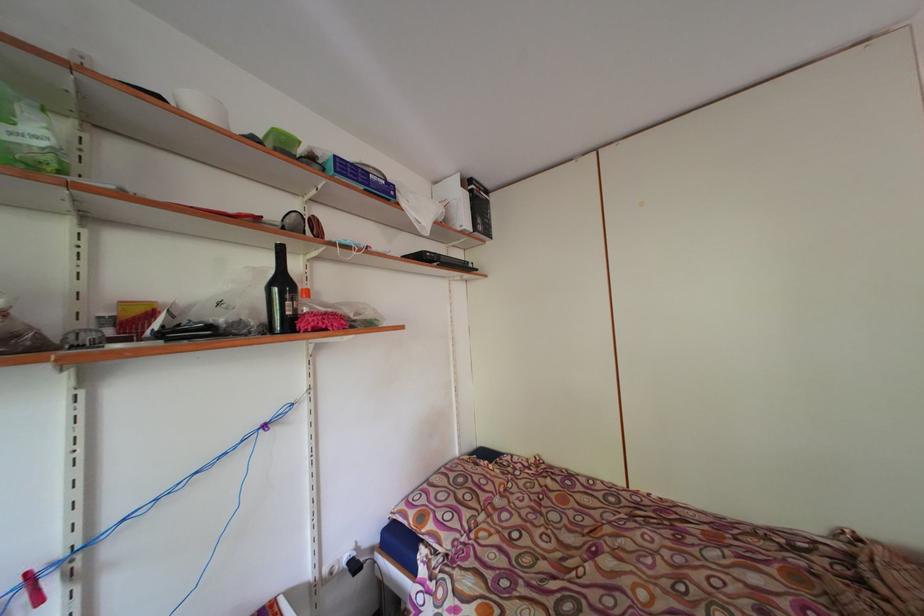
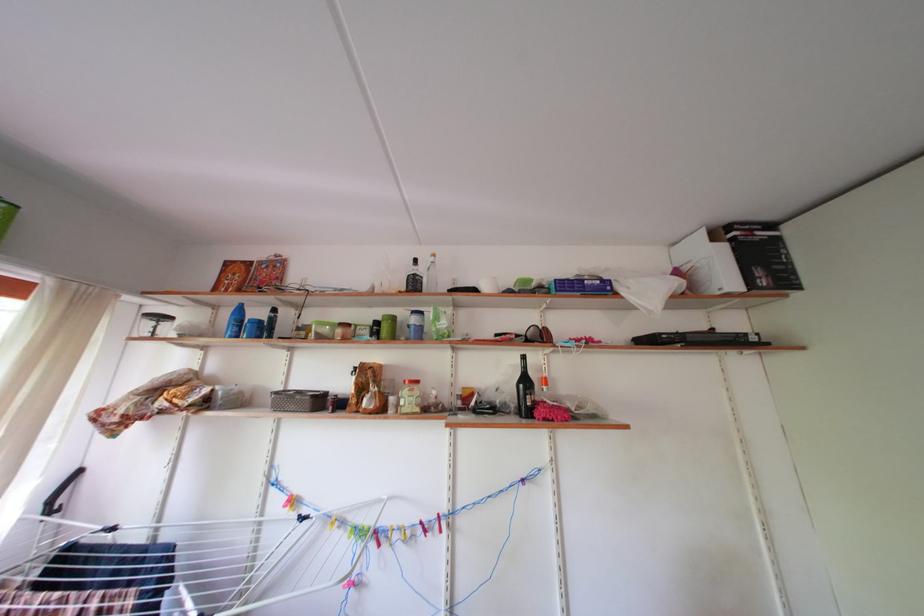
Where in the second image is the point corresponding to the point at 290,289 from the first image?

(533, 387)